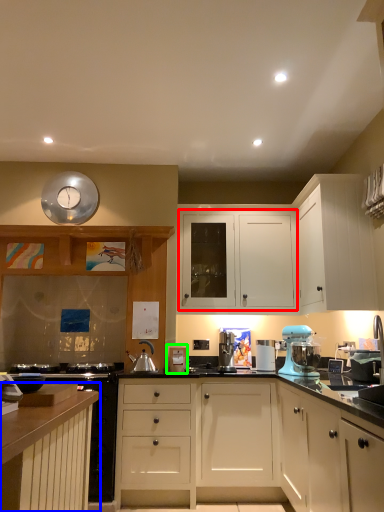
Question: Which is farther away from cabinetry (highlighted by a red box)? cabinetry (highlighted by a blue box) or appliance (highlighted by a green box)?

Choices:
 (A) cabinetry
 (B) appliance

Answer: (A)